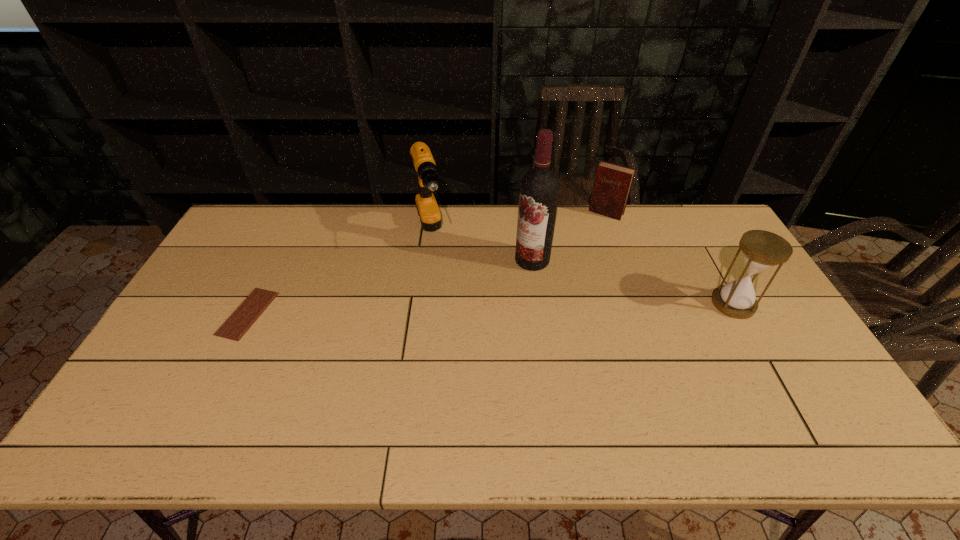
The width and height of the screenshot is (960, 540). What are the coordinates of `unoccupied position between the second shortest object and the rightmost object` in the screenshot? It's located at (670, 258).

You are a GUI agent. You are given a task and a screenshot of the screen. Output one action in this format:
    pyautogui.click(x=<x>, y=<y>)
    Task: Click on the vacant space that's between the leftmost object and the third object from left to right
    
    Given the screenshot: What is the action you would take?
    pyautogui.click(x=390, y=287)

Find the location of `vacant region between the third object from right to left and the drill`. vacant region between the third object from right to left and the drill is located at coordinates (481, 247).

Find the location of `vacant region between the tallest object and the leftmost object`. vacant region between the tallest object and the leftmost object is located at coordinates (390, 287).

The height and width of the screenshot is (540, 960). Find the location of `vacant space that is in between the tallest object and the chocolate bar`. vacant space that is in between the tallest object and the chocolate bar is located at coordinates (390, 287).

Where is `free spot between the shortest object and the drill`? free spot between the shortest object and the drill is located at coordinates pyautogui.click(x=339, y=273).

Find the location of `empty location between the leftmost object and the fourth shortest object`. empty location between the leftmost object and the fourth shortest object is located at coordinates (339, 273).

This screenshot has height=540, width=960. What are the coordinates of `unoccupied position between the leftmost object and the second shortest object` in the screenshot? It's located at (427, 263).

You are a GUI agent. You are given a task and a screenshot of the screen. Output one action in this format:
    pyautogui.click(x=<x>, y=<y>)
    Task: Click on the empty space that is in between the diary and the third tallest object
    The image size is (960, 540).
    Given the screenshot: What is the action you would take?
    pyautogui.click(x=670, y=258)

Point out which object is positioned as the third nearest to the shortest object. Please provide its 2D coordinates. Your answer should be formatted as a tuple, i.e. [(x, y)], where the tuple contains the x and y coordinates of a point satisfying the conditions above.

[(612, 184)]